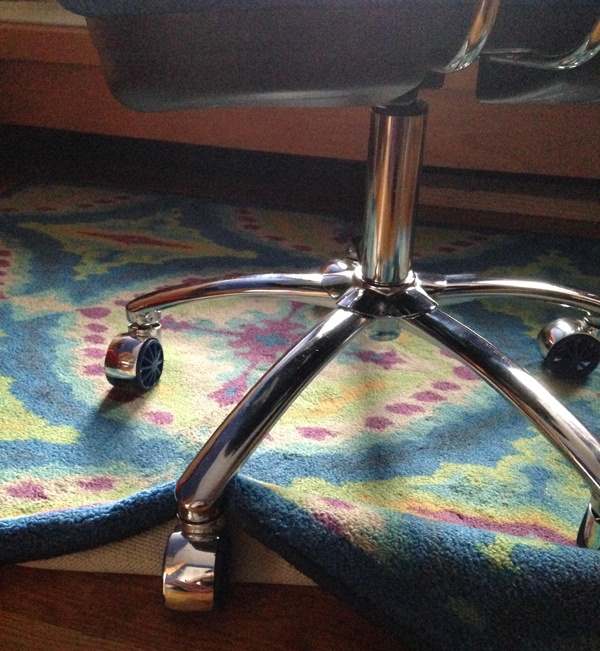
Identify the location of wood furniture. (534, 145).